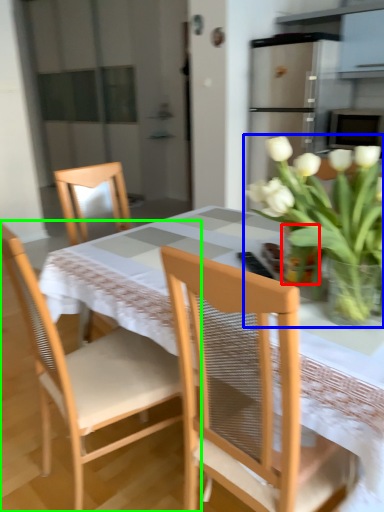
Question: Based on their relative distances, which object is nearer to glass vase (highlighted by a red box)? Choose from houseplant (highlighted by a blue box) and chair (highlighted by a green box).

Choices:
 (A) houseplant
 (B) chair

Answer: (A)